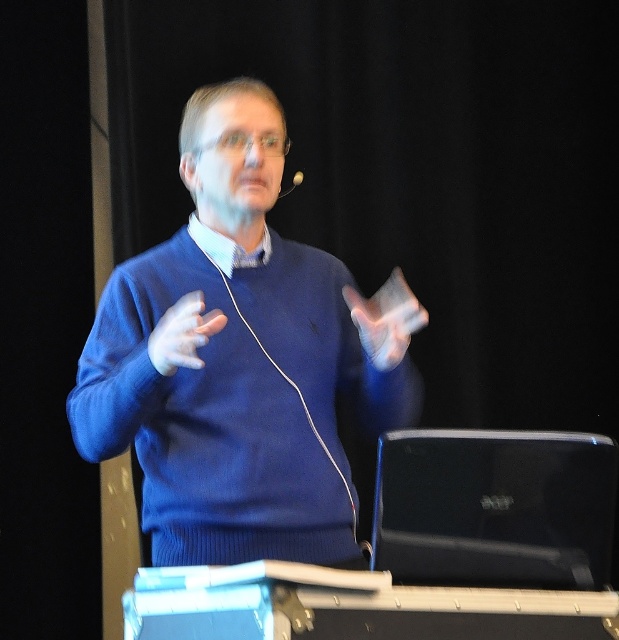
Question: Is blue knitwear at center above black matte laptop at lower right?

Choices:
 (A) yes
 (B) no

Answer: (A)

Question: Which point appears farthest from the camera in this image?

Choices:
 (A) (400, 582)
 (B) (297, 182)

Answer: (B)

Question: Can you confirm if black matte laptop at lower right is positioned to the left of silver metallic earphone at upper center?

Choices:
 (A) yes
 (B) no

Answer: (B)

Question: Which is farther from the silver metallic earphone at upper center?

Choices:
 (A) blue knitwear at center
 (B) matte blue sweater at center

Answer: (B)

Question: Can you confirm if blue knitwear at center is bigger than matte blue sweater at center?

Choices:
 (A) no
 (B) yes

Answer: (B)

Question: Which point is farther to the camera?

Choices:
 (A) (115, 381)
 (B) (175, 368)

Answer: (A)